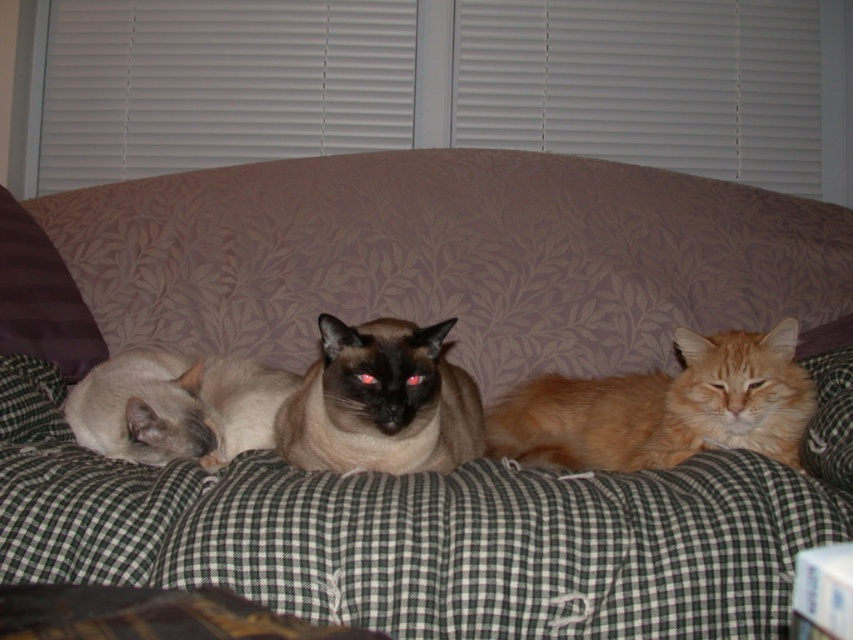
The height and width of the screenshot is (640, 853). What do you see at coordinates (663, 406) in the screenshot?
I see `orange fluffy cat at center` at bounding box center [663, 406].

From the picture: Is orange fluffy cat at center taller than smokey brown fur at center?

Indeed, orange fluffy cat at center has a greater height compared to smokey brown fur at center.

Does point (527, 385) come farther from viewer compared to point (395, 333)?

Yes, point (527, 385) is behind point (395, 333).

Locate an element on the screen. The width and height of the screenshot is (853, 640). orange fluffy cat at center is located at coordinates (663, 406).

Who is lower down, silky white cat at left or brown striped pillow at left?

silky white cat at left

Which of these two, silky white cat at left or brown striped pillow at left, stands taller?

brown striped pillow at left

Does point (132, 390) lie behind point (35, 266)?

No, it is not.

Where is `silky white cat at left`? The height and width of the screenshot is (640, 853). silky white cat at left is located at coordinates (177, 406).

Is the position of smokey brown fur at center less distant than that of brown striped pillow at left?

Yes, smokey brown fur at center is in front of brown striped pillow at left.

Which is behind, point (323, 458) or point (1, 253)?

Point (1, 253)

Is point (463, 460) less distant than point (32, 252)?

Yes, point (463, 460) is in front of point (32, 252).

Find the location of a particular element. smokey brown fur at center is located at coordinates (381, 401).